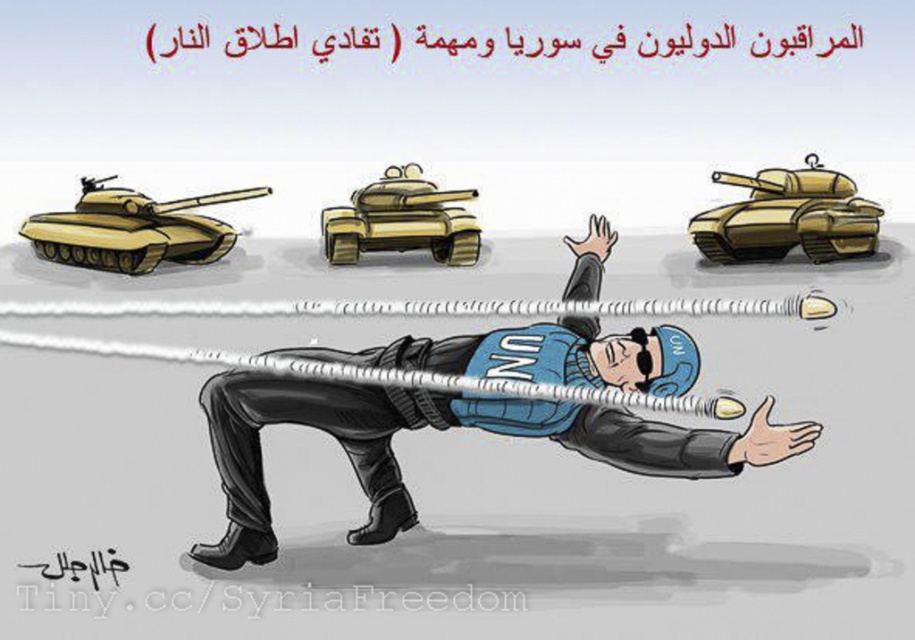
Based on the scene described, which object is larger in size between the blue fabric un vest at center and the gold metallic tank at upper right?

The blue fabric un vest at center is bigger than the gold metallic tank at upper right according to the description.

You are a UN peacekeeper in Syria. You notice two critical points in your path. The first is at point (821, 204) and the second is at point (439, 259). Which point is closer to your current position?

Point (821, 204) is in front of point (439, 259), so it is closer to your current position.